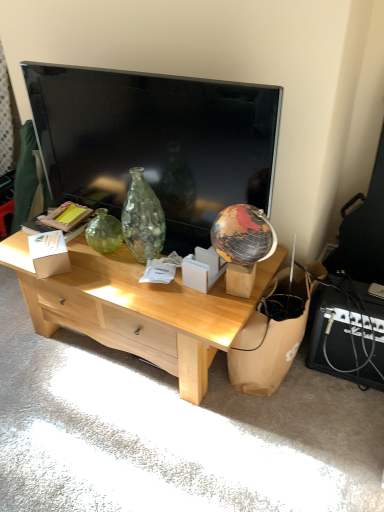
Locate an element on the screen. This screenshot has width=384, height=512. vacant space to the right of white cardboard box at center, marked as the 2th cardboard box in a right-to-left arrangement is located at coordinates (102, 271).